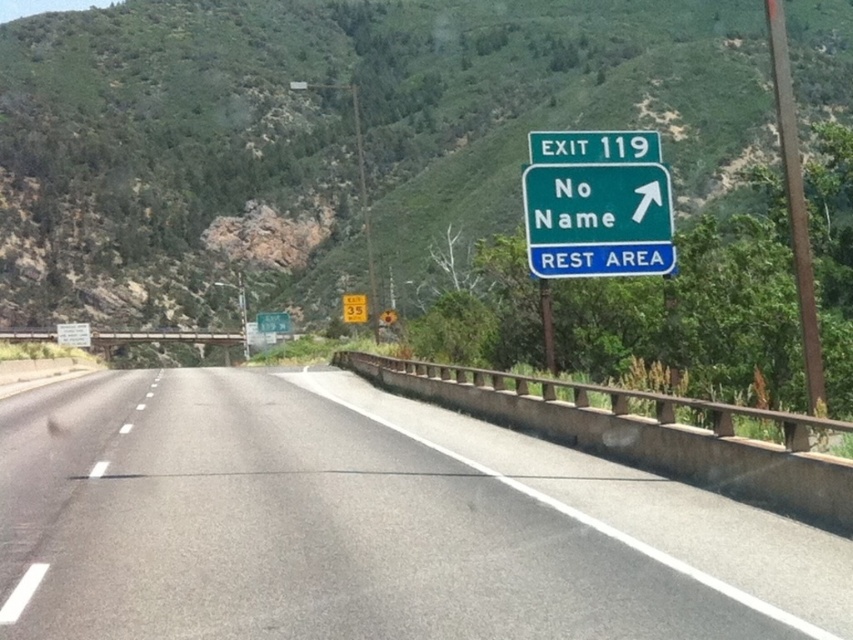
Question: Among these points, which one is nearest to the camera?

Choices:
 (A) (788, 616)
 (B) (608, 257)

Answer: (A)

Question: Does green forested mountain at upper center appear on the left side of gray asphalt road at center?

Choices:
 (A) no
 (B) yes

Answer: (A)

Question: Is green forested mountain at upper center to the right of green metallic sign at upper right from the viewer's perspective?

Choices:
 (A) yes
 (B) no

Answer: (B)

Question: Does green glossy sign at upper right appear under green metallic sign at upper right?

Choices:
 (A) yes
 (B) no

Answer: (A)

Question: Which object is closer to the camera taking this photo?

Choices:
 (A) green glossy sign at upper right
 (B) green metallic sign at upper right
 (C) green forested mountain at upper center

Answer: (A)

Question: Among these objects, which one is farthest from the camera?

Choices:
 (A) green forested mountain at upper center
 (B) gray asphalt road at center
 (C) green metallic sign at upper right
 (D) green glossy sign at upper right

Answer: (A)